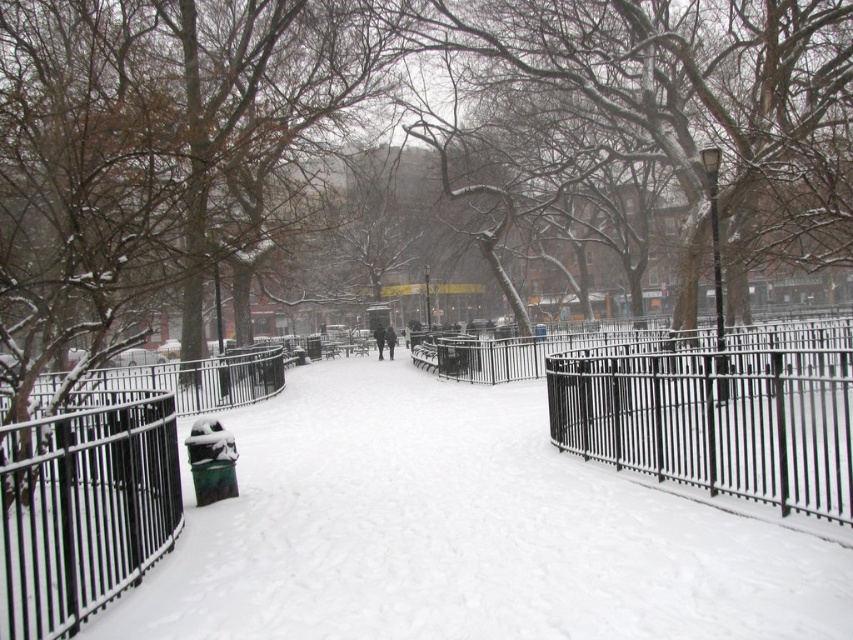
Question: Which object appears farthest from the camera in this image?

Choices:
 (A) white snow-covered pavement at center
 (B) black matte jacket at center
 (C) black metal fence at center
 (D) dark gray coat at center

Answer: (B)

Question: Is black matte jacket at center thinner than dark gray coat at center?

Choices:
 (A) yes
 (B) no

Answer: (B)

Question: Can you confirm if black matte jacket at center is smaller than dark gray coat at center?

Choices:
 (A) no
 (B) yes

Answer: (A)

Question: Which is nearer to the white snow-covered pavement at center?

Choices:
 (A) black matte jacket at center
 (B) black metal fence at center
 (C) dark gray coat at center

Answer: (B)

Question: Is white snow-covered pavement at center further to camera compared to black matte jacket at center?

Choices:
 (A) no
 (B) yes

Answer: (A)

Question: Which point is closer to the camera?

Choices:
 (A) black metal fence at center
 (B) black matte jacket at center

Answer: (A)